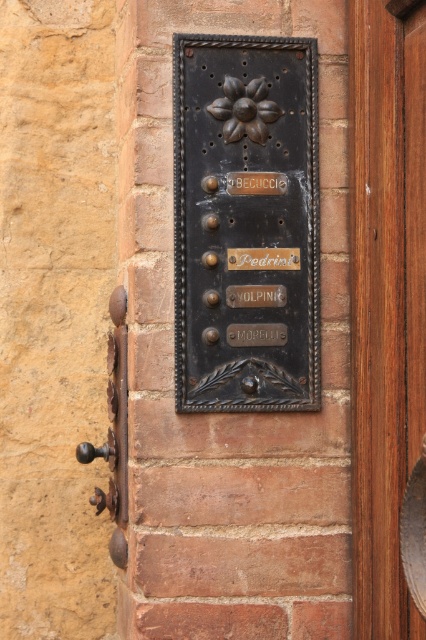
Question: Does matte black plaque at center have a greater width compared to rusty metal door handle at left?

Choices:
 (A) no
 (B) yes

Answer: (B)

Question: Which of the following is the closest to the observer?

Choices:
 (A) matte black plaque at center
 (B) rusty metal door handle at left

Answer: (A)

Question: Can you confirm if matte black plaque at center is positioned to the left of rusty metal door handle at left?

Choices:
 (A) no
 (B) yes

Answer: (A)

Question: Among these objects, which one is farthest from the camera?

Choices:
 (A) matte black plaque at center
 (B) brown wooden door at right

Answer: (A)

Question: Which of the following is the closest to the observer?

Choices:
 (A) (377, 628)
 (B) (115, 552)

Answer: (A)

Question: In this image, where is matte black plaque at center located relative to brown wooden door at right?

Choices:
 (A) below
 (B) above

Answer: (B)